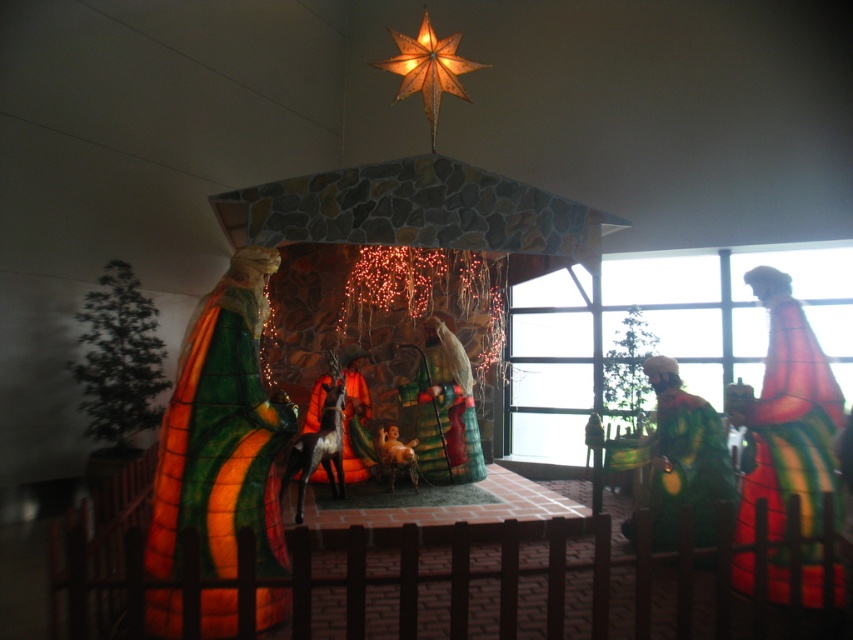
Question: Which point is farther from the camera taking this photo?

Choices:
 (A) (463, 429)
 (B) (314, 384)
 (C) (805, 445)

Answer: (A)

Question: Does transparent glass window at right have a smaller size compared to green textured robe at right?

Choices:
 (A) no
 (B) yes

Answer: (A)

Question: Among these objects, which one is nearest to the camera?

Choices:
 (A) matte green fabric figure at center
 (B) shiny green fabric at center
 (C) matte orange robe at center

Answer: (A)

Question: Is transparent glass window at right wider than matte green fabric figure at center?

Choices:
 (A) no
 (B) yes

Answer: (B)

Question: Does transparent glass window at right have a smaller size compared to shiny green fabric at center?

Choices:
 (A) yes
 (B) no

Answer: (B)

Question: Which point is farther to the camera?

Choices:
 (A) (521, 390)
 (B) (346, 477)
 (C) (741, 541)

Answer: (A)